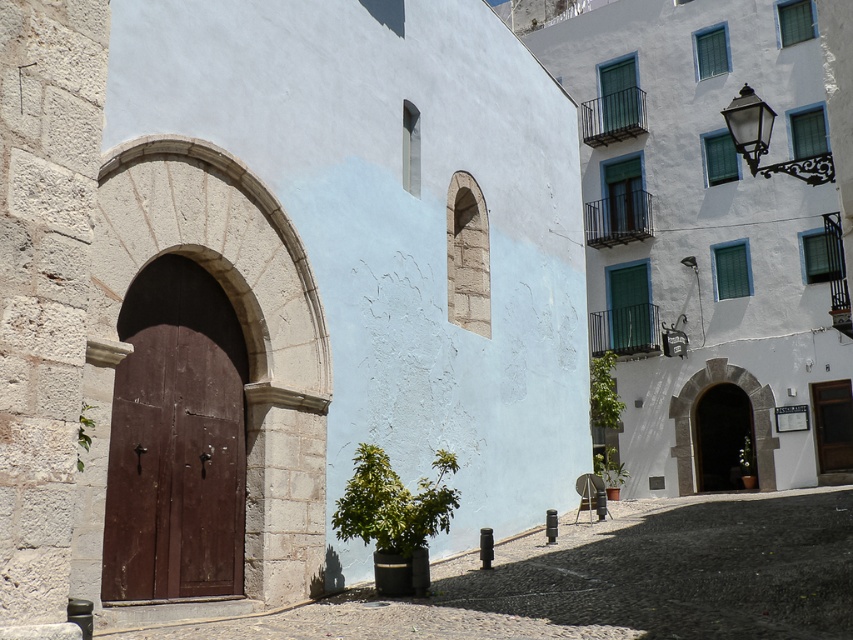
Question: Considering the real-world distances, which object is closest to the brown wooden door at center?

Choices:
 (A) smooth stone alley at center
 (B) stone archway at center

Answer: (B)

Question: Which of the following is the closest to the observer?

Choices:
 (A) (231, 211)
 (B) (815, 548)
 (C) (672, 413)

Answer: (A)

Question: Can you confirm if stone archway at center is wider than smooth white archway at center?

Choices:
 (A) no
 (B) yes

Answer: (A)

Question: Is smooth stone alley at center behind smooth white archway at center?

Choices:
 (A) no
 (B) yes

Answer: (A)

Question: Which point is closer to the camera?

Choices:
 (A) brown wooden door at center
 (B) stone archway at center
 (C) smooth stone alley at center

Answer: (C)

Question: Does stone archway at center have a smaller size compared to brown wooden door at center?

Choices:
 (A) yes
 (B) no

Answer: (B)